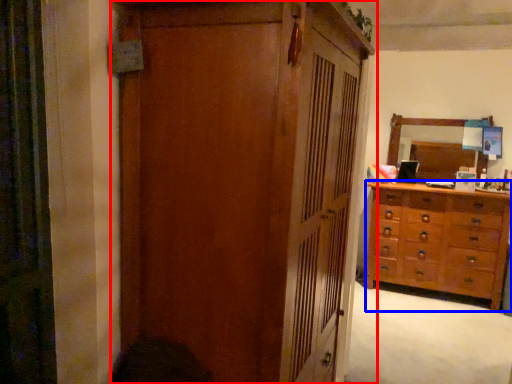
Question: Which object appears closest to the camera in this image, cupboard (highlighted by a red box) or chest of drawers (highlighted by a blue box)?

Choices:
 (A) cupboard
 (B) chest of drawers

Answer: (A)